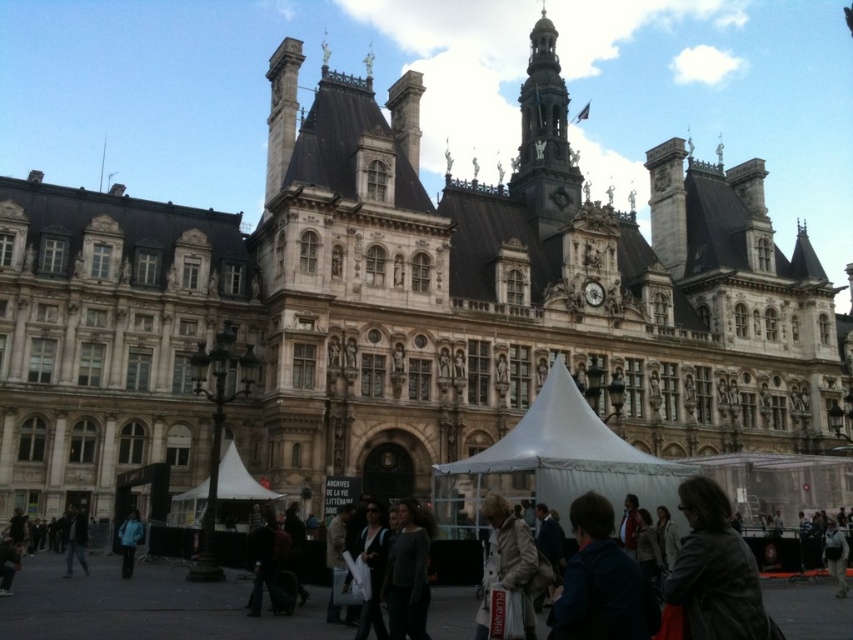
Question: Which object appears farthest from the camera in this image?

Choices:
 (A) light beige coat at center
 (B) gold ornate clock tower at upper center
 (C) dark blue jacket at center
 (D) leather jacket at center

Answer: (B)

Question: Is dark gray jacket at lower left thinner than blue fabric jacket at lower left?

Choices:
 (A) yes
 (B) no

Answer: (B)

Question: Which object is the closest to the blue fabric jacket at lower left?

Choices:
 (A) matte black jacket at center
 (B) leather jacket at center

Answer: (A)

Question: Can you confirm if white fabric tent at center is smaller than dark blue jacket at center?

Choices:
 (A) yes
 (B) no

Answer: (B)

Question: Can you confirm if light beige coat at center is positioned to the left of dark gray jacket at lower left?

Choices:
 (A) yes
 (B) no

Answer: (B)

Question: Among these objects, which one is nearest to the camera?

Choices:
 (A) white fabric tent at center
 (B) leather jacket at center

Answer: (B)